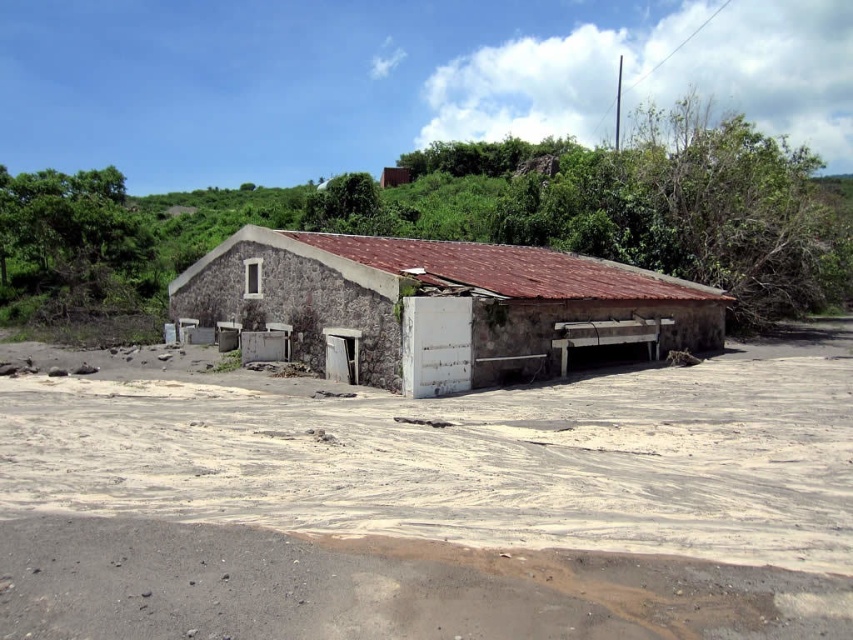
Can you confirm if brown sandy ground at lower center is positioned to the right of stone textured hut at center?

Yes, brown sandy ground at lower center is to the right of stone textured hut at center.

Is point (297, 609) farther from camera compared to point (328, 241)?

That is False.

This screenshot has width=853, height=640. In order to click on brown sandy ground at lower center in this screenshot , I will do `click(379, 588)`.

Who is taller, white sandy dirt at center or stone textured hut at center?

stone textured hut at center

Image resolution: width=853 pixels, height=640 pixels. In order to click on white sandy dirt at center in this screenshot , I will do `click(428, 504)`.

This screenshot has height=640, width=853. Describe the element at coordinates (428, 504) in the screenshot. I see `white sandy dirt at center` at that location.

At what (x,y) coordinates should I click in order to perform the action: click on white sandy dirt at center. Please return your answer as a coordinate pair (x, y). The image size is (853, 640). Looking at the image, I should click on (428, 504).

Does point (173, 515) come closer to viewer compared to point (357, 628)?

That is False.

The width and height of the screenshot is (853, 640). What do you see at coordinates (428, 504) in the screenshot?
I see `white sandy dirt at center` at bounding box center [428, 504].

Where is `white sandy dirt at center`? white sandy dirt at center is located at coordinates (428, 504).